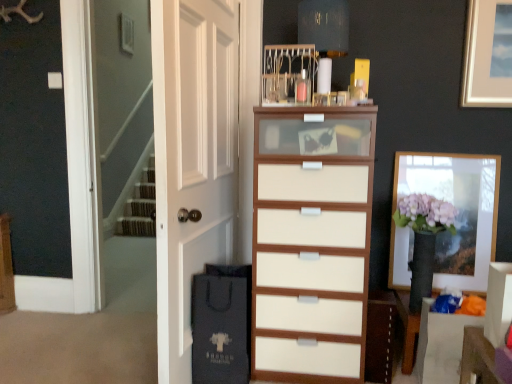
Question: Is white wood cabinet at center oriented away from matte black shopping bag at lower left?

Choices:
 (A) yes
 (B) no

Answer: (B)

Question: Is white wood cabinet at center next to matte black shopping bag at lower left?

Choices:
 (A) yes
 (B) no

Answer: (B)

Question: Does white wood cabinet at center have a greater width compared to matte black shopping bag at lower left?

Choices:
 (A) yes
 (B) no

Answer: (B)

Question: Considering the relative sizes of white wood cabinet at center and matte black shopping bag at lower left in the image provided, is white wood cabinet at center shorter than matte black shopping bag at lower left?

Choices:
 (A) yes
 (B) no

Answer: (A)

Question: From a real-world perspective, is white wood cabinet at center over matte black shopping bag at lower left?

Choices:
 (A) no
 (B) yes

Answer: (A)

Question: Based on their positions, is white matte door at center located to the left or right of white wood cabinet at center?

Choices:
 (A) left
 (B) right

Answer: (A)

Question: Is white matte door at center inside or outside of white wood cabinet at center?

Choices:
 (A) outside
 (B) inside

Answer: (A)

Question: Is point (166, 329) closer or farther from the camera than point (379, 319)?

Choices:
 (A) farther
 (B) closer

Answer: (B)

Question: From a real-world perspective, relative to white wood cabinet at center, is white matte door at center vertically above or below?

Choices:
 (A) below
 (B) above

Answer: (B)

Question: Looking at their shapes, would you say white matte door at center is wider or thinner than white wood chest of drawers at center?

Choices:
 (A) thin
 (B) wide

Answer: (A)

Question: Is point (173, 329) positioned closer to the camera than point (347, 107)?

Choices:
 (A) farther
 (B) closer

Answer: (B)

Question: Considering the positions of white matte door at center and white wood chest of drawers at center in the image, is white matte door at center bigger or smaller than white wood chest of drawers at center?

Choices:
 (A) small
 (B) big

Answer: (A)

Question: In terms of height, does white matte door at center look taller or shorter compared to white wood chest of drawers at center?

Choices:
 (A) tall
 (B) short

Answer: (A)

Question: Is matte black shopping bag at lower left bigger or smaller than white wood cabinet at center?

Choices:
 (A) small
 (B) big

Answer: (B)

Question: Choose the correct answer: Is matte black shopping bag at lower left inside white wood cabinet at center or outside it?

Choices:
 (A) inside
 (B) outside

Answer: (B)